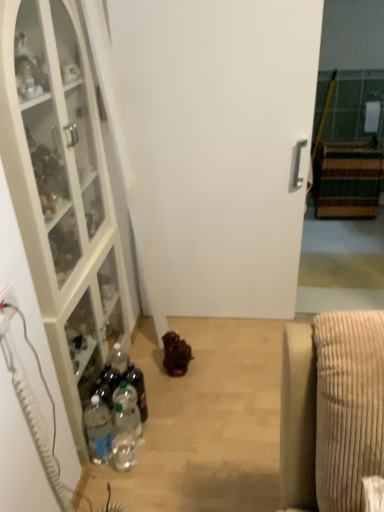
At what (x,y) coordinates should I click in order to perform the action: click on free location in front of clear plastic bottle at lower left, marked as the second bottle in a right-to-left arrangement. Please return your answer as a coordinate pair (x, y). Looking at the image, I should click on (140, 477).